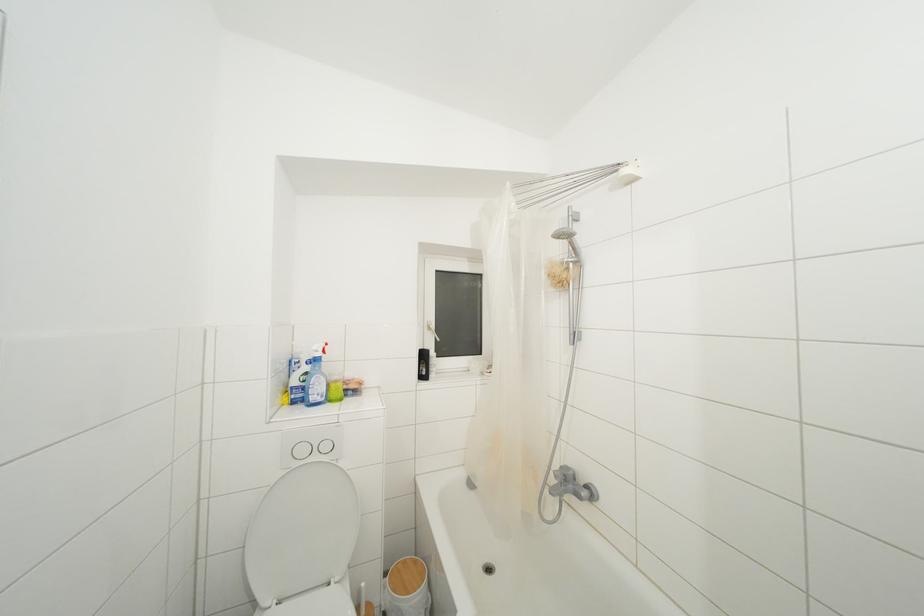
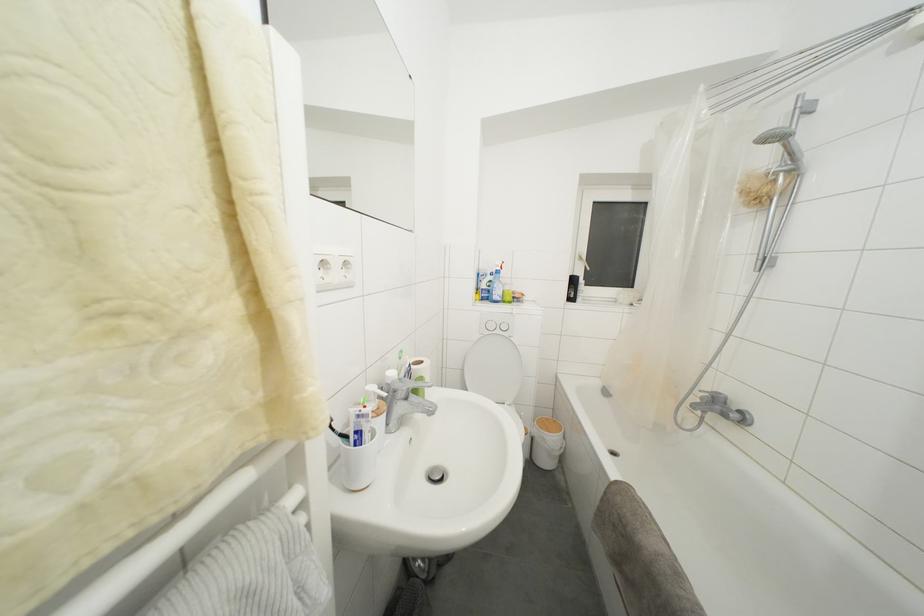
In the second image, find the point that corresponds to (356,395) in the first image.

(520, 304)